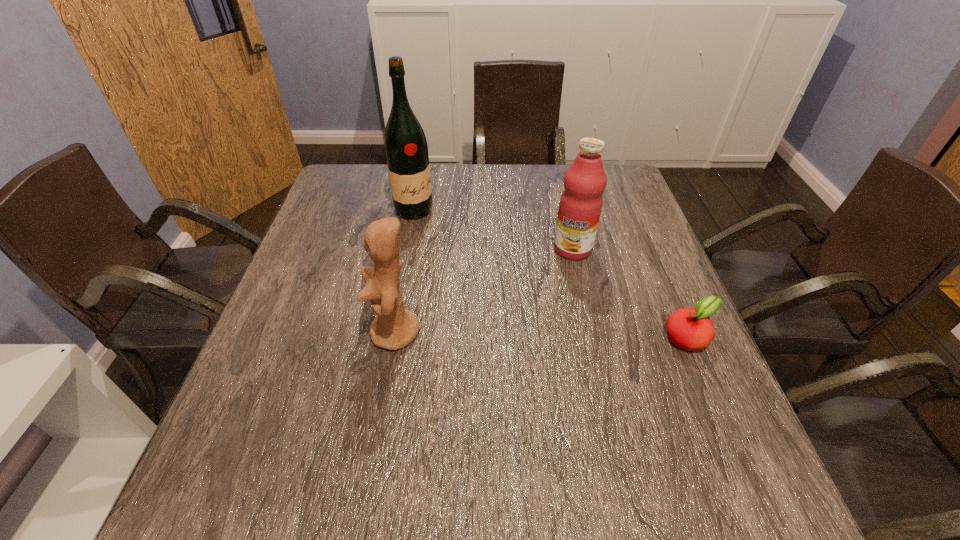
I want to click on figurine, so click(x=394, y=327).

Locate an element on the screen. the rightmost object is located at coordinates (688, 328).

Identify the location of apple. (688, 328).

At what (x,y) coordinates should I click in order to perform the action: click on the tallest object. Please return your answer as a coordinate pair (x, y). The image size is (960, 540). Looking at the image, I should click on (406, 149).

I want to click on the farthest object, so click(x=406, y=149).

Locate an element on the screen. This screenshot has width=960, height=540. the third nearest object is located at coordinates (580, 206).

Image resolution: width=960 pixels, height=540 pixels. What are the coordinates of `the third object from left to right` in the screenshot? It's located at (580, 206).

Find the location of a particular element. This screenshot has height=540, width=960. blank space located 0.110m on the front-facing side of the figurine is located at coordinates (320, 333).

This screenshot has height=540, width=960. Find the location of `vacant space located 0.050m on the front-facing side of the figurine`. vacant space located 0.050m on the front-facing side of the figurine is located at coordinates (348, 333).

Where is `vacant region located 0.120m on the front-facing side of the figurine`? vacant region located 0.120m on the front-facing side of the figurine is located at coordinates (315, 333).